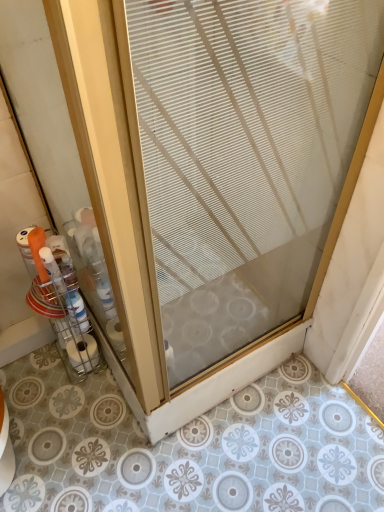
Question: From the image's perspective, does clear plastic container at left appear lower than clear glass door at center?

Choices:
 (A) no
 (B) yes

Answer: (B)

Question: Is clear plastic container at left not inside clear glass door at center?

Choices:
 (A) no
 (B) yes

Answer: (B)

Question: Is clear plastic container at left next to clear glass door at center and touching it?

Choices:
 (A) no
 (B) yes

Answer: (A)

Question: Can you confirm if clear plastic container at left is positioned to the left of clear glass door at center?

Choices:
 (A) yes
 (B) no

Answer: (A)

Question: Does clear plastic container at left have a greater height compared to clear glass door at center?

Choices:
 (A) no
 (B) yes

Answer: (A)

Question: From a real-world perspective, is clear plastic container at left physically above clear glass door at center?

Choices:
 (A) no
 (B) yes

Answer: (A)

Question: Does white matte toilet paper at lower left have a greater height compared to clear glass door at center?

Choices:
 (A) yes
 (B) no

Answer: (B)

Question: Is clear glass door at center located within white matte toilet paper at lower left?

Choices:
 (A) yes
 (B) no

Answer: (B)

Question: Is white matte toilet paper at lower left beside clear glass door at center?

Choices:
 (A) yes
 (B) no

Answer: (B)

Question: Does white matte toilet paper at lower left have a larger size compared to clear glass door at center?

Choices:
 (A) yes
 (B) no

Answer: (B)

Question: From the image's perspective, does white matte toilet paper at lower left appear higher than clear glass door at center?

Choices:
 (A) yes
 (B) no

Answer: (B)

Question: From a real-world perspective, is white matte toilet paper at lower left physically above clear glass door at center?

Choices:
 (A) no
 (B) yes

Answer: (A)

Question: Is white matte toilet paper at lower left at the right side of clear plastic container at left?

Choices:
 (A) yes
 (B) no

Answer: (A)